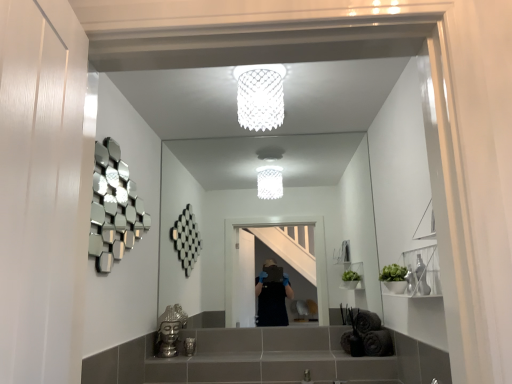
Identify the location of free space that is to the left of metallic silver toiletry at lower center. Image resolution: width=512 pixels, height=384 pixels. (169, 349).